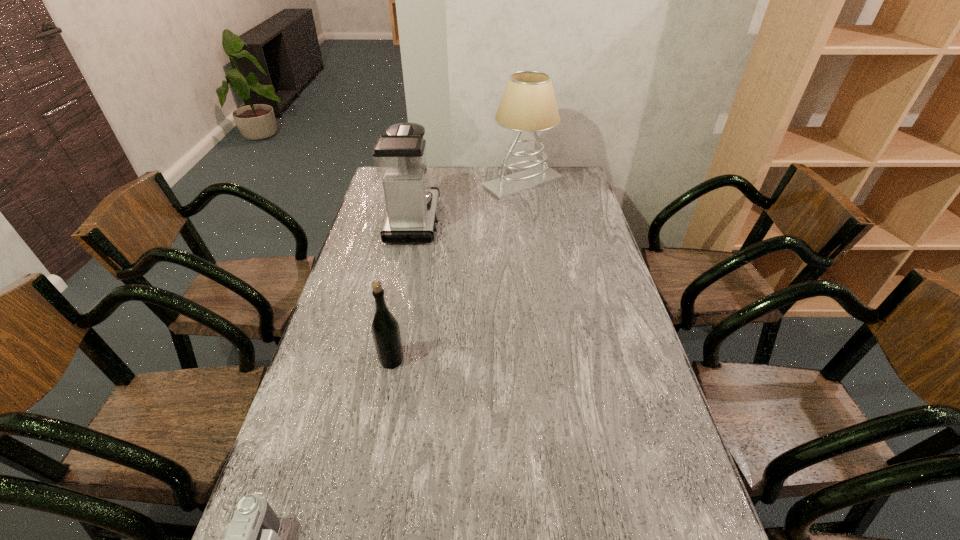
Choose which object is the second nearest neighbor to the third tallest object. Please provide its 2D coordinates. Your answer should be formatted as a tuple, i.e. [(x, y)], where the tuple contains the x and y coordinates of a point satisfying the conditions above.

[(399, 156)]

Image resolution: width=960 pixels, height=540 pixels. What are the coordinates of `free spot that satisfies the following two spatial constraints: 1. on the back side of the tallest object; 2. on the right side of the beer bottle` in the screenshot? It's located at (425, 183).

Identify the location of vacant area that satisfies the following two spatial constraints: 1. at the front of the second tallest object where the controls are located; 2. on the left side of the second nearest object. This screenshot has height=540, width=960. (386, 360).

Locate an element on the screen. The image size is (960, 540). vacant space that satisfies the following two spatial constraints: 1. at the front of the coffee maker where the controls are located; 2. on the right side of the beer bottle is located at coordinates (386, 360).

Identify the location of vacant point that satisfies the following two spatial constraints: 1. at the front of the third farthest object where the controls are located; 2. on the right side of the second tallest object. (386, 360).

This screenshot has height=540, width=960. I want to click on free location that satisfies the following two spatial constraints: 1. at the front of the second tallest object where the controls are located; 2. on the left side of the beer bottle, so click(386, 360).